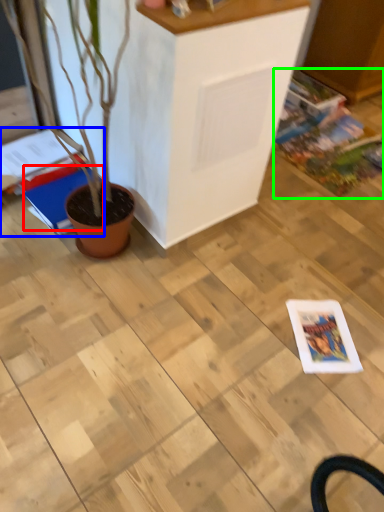
Question: Estimate the real-world distances between objects in this image. Which object is closer to magazine (highlighted by a red box), magazine (highlighted by a blue box) or comic book (highlighted by a green box)?

Choices:
 (A) magazine
 (B) comic book

Answer: (A)